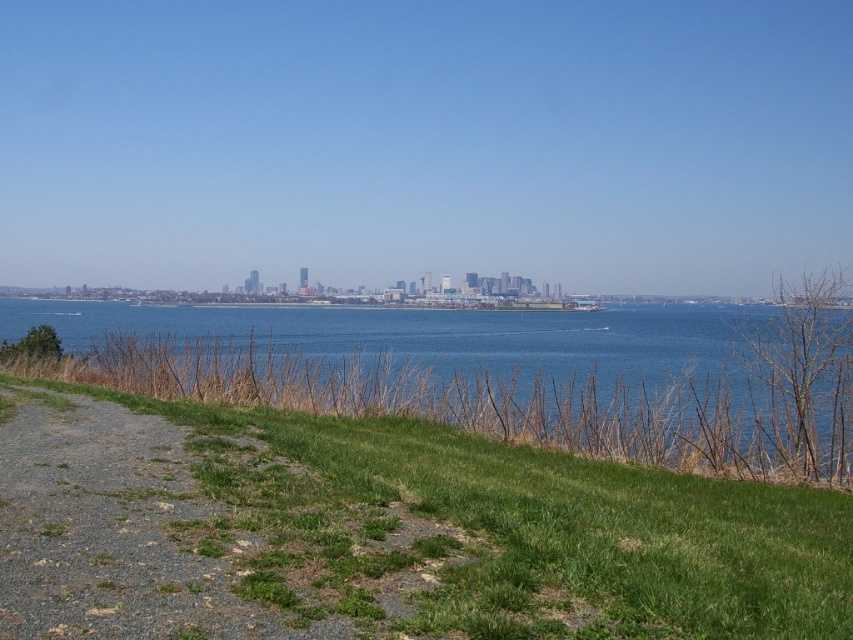
Between green grassy slope at lower left and blue water at center, which one has less height?

green grassy slope at lower left is shorter.

Between green grassy slope at lower left and blue water at center, which one appears on the right side from the viewer's perspective?

Positioned to the right is blue water at center.

Who is more distant from viewer, [142,492] or [643,384]?

Point [643,384]

Locate an element on the screen. Image resolution: width=853 pixels, height=640 pixels. green grassy slope at lower left is located at coordinates (386, 534).